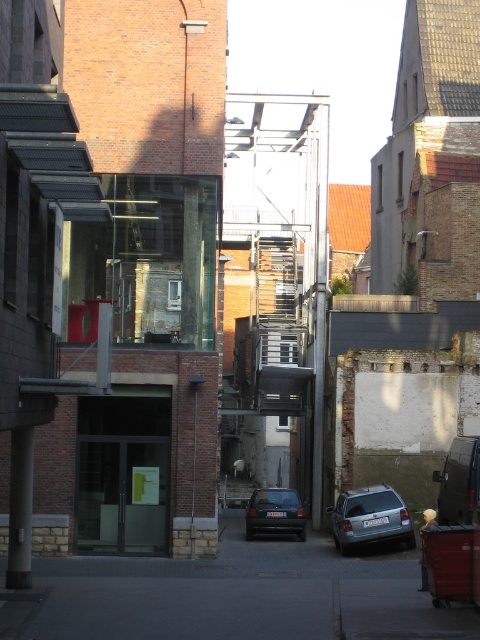
Question: Which point is closer to the camera?

Choices:
 (A) dark gray matte car at center
 (B) satin silver car at lower center

Answer: (B)

Question: Which point is closer to the camera?

Choices:
 (A) satin silver car at lower center
 (B) dark gray matte car at center

Answer: (A)

Question: Can you confirm if satin silver car at lower center is positioned above dark gray matte car at center?

Choices:
 (A) yes
 (B) no

Answer: (A)

Question: Is satin silver car at lower center further to camera compared to dark gray matte car at center?

Choices:
 (A) no
 (B) yes

Answer: (A)

Question: Can you confirm if satin silver car at lower center is positioned to the left of dark gray matte car at center?

Choices:
 (A) yes
 (B) no

Answer: (B)